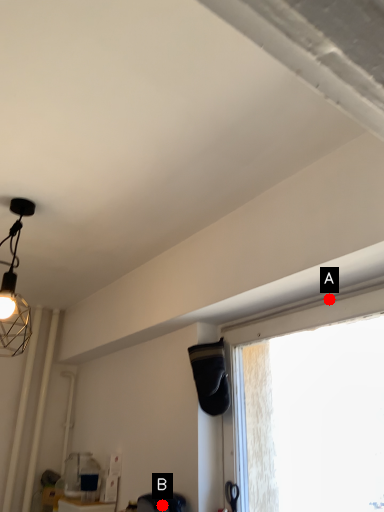
Question: Two points are circled on the image, labeled by A and B beside each circle. Which point appears closest to the camera in this image?

Choices:
 (A) A is closer
 (B) B is closer

Answer: (A)